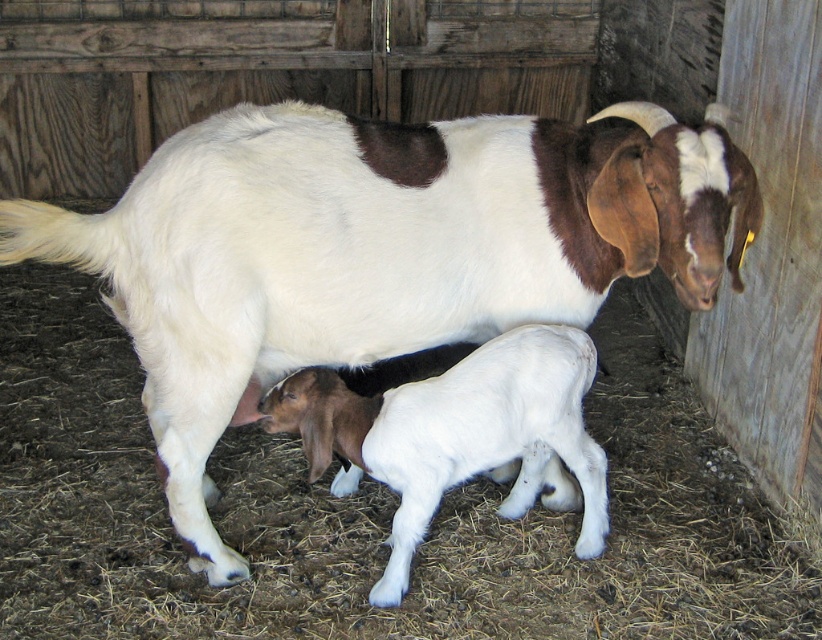
Question: Is white soft fur goat at center thinner than white woolen lamb at center?

Choices:
 (A) yes
 (B) no

Answer: (B)

Question: Among these objects, which one is farthest from the camera?

Choices:
 (A) white soft fur goat at center
 (B) white woolen lamb at center

Answer: (B)

Question: Which point is closer to the camera?

Choices:
 (A) white soft fur goat at center
 (B) white woolen lamb at center

Answer: (A)

Question: Observing the image, what is the correct spatial positioning of white soft fur goat at center in reference to white woolen lamb at center?

Choices:
 (A) right
 (B) left

Answer: (B)

Question: Does white soft fur goat at center have a lesser width compared to white woolen lamb at center?

Choices:
 (A) yes
 (B) no

Answer: (B)